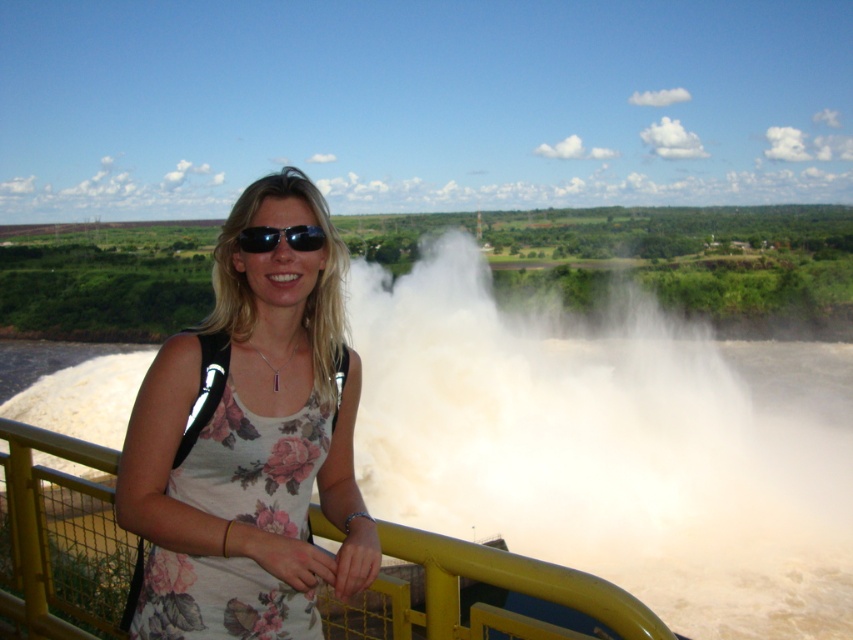
Question: Which of the following is the closest to the observer?

Choices:
 (A) (303, 237)
 (B) (126, 516)

Answer: (B)

Question: Is floral fabric dress at center thinner than yellow metal railing at center?

Choices:
 (A) yes
 (B) no

Answer: (A)

Question: Which of the following is the closest to the observer?

Choices:
 (A) floral fabric dress at center
 (B) black reflective sunglasses at center
 (C) white frothy water at center
 (D) yellow metal railing at center

Answer: (D)

Question: Which object is positioned closest to the floral fabric dress at center?

Choices:
 (A) yellow metal railing at center
 (B) white frothy water at center

Answer: (A)

Question: Does yellow metal railing at center have a smaller size compared to black reflective sunglasses at center?

Choices:
 (A) no
 (B) yes

Answer: (A)

Question: Is floral fabric dress at center below yellow metal railing at center?

Choices:
 (A) yes
 (B) no

Answer: (B)